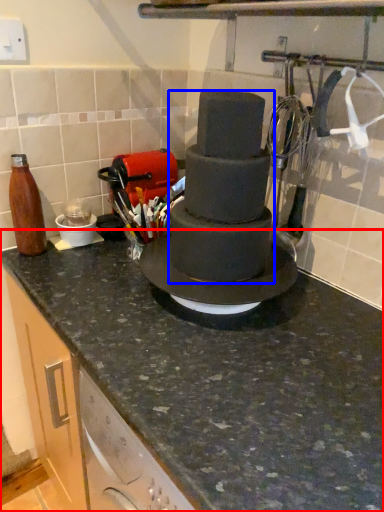
Question: Which point is further to the camera, countertop (highlighted by a red box) or chocolate cake (highlighted by a blue box)?

Choices:
 (A) countertop
 (B) chocolate cake

Answer: (B)